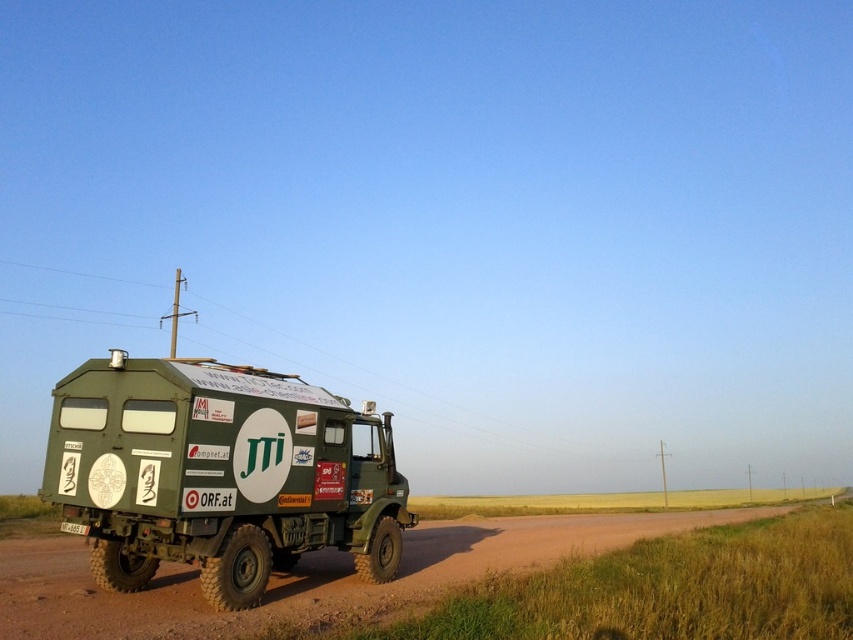
Can you confirm if green matte truck at left is positioned below white plastic license plate at lower left?

No, green matte truck at left is not below white plastic license plate at lower left.

Who is more forward, (376, 420) or (76, 529)?

Point (76, 529)

Where is `green matte truck at left`? The image size is (853, 640). green matte truck at left is located at coordinates tap(219, 474).